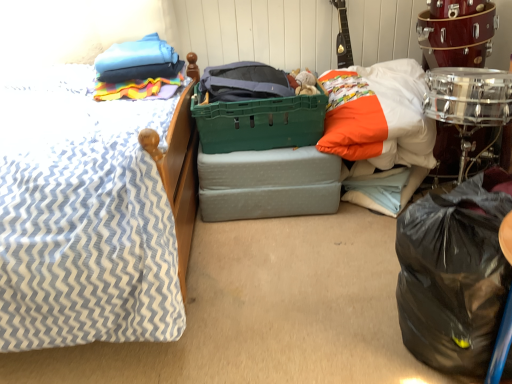
Find the location of a particular element. black plastic bag at lower right is located at coordinates (454, 273).

Describe the element at coordinates (259, 122) in the screenshot. I see `green plastic basket at center` at that location.

Locate an element on the screen. black plastic bag at lower right is located at coordinates (454, 273).

Between black plastic bag at lower right and blue fabric pillow at upper left, the 2th pillow when ordered from right to left, which one appears on the right side from the viewer's perspective?

black plastic bag at lower right is more to the right.

From the image's perspective, who appears lower, black plastic bag at lower right or blue fabric pillow at upper left, which is the first pillow from left to right?

black plastic bag at lower right appears lower in the image.

Is black plastic bag at lower right with blue fabric pillow at upper left, which is the first pillow from left to right?

No, black plastic bag at lower right is not making contact with blue fabric pillow at upper left, which is the first pillow from left to right.

From a real-world perspective, is black plastic bag at lower right above or below blue fabric pillow at upper left, the 2th pillow when ordered from right to left?

black plastic bag at lower right is situated lower than blue fabric pillow at upper left, the 2th pillow when ordered from right to left, in the real world.

From a real-world perspective, who is located lower, shiny silver drum at right or green plastic basket at center?

green plastic basket at center is physically lower.

From their relative heights in the image, would you say shiny silver drum at right is taller or shorter than green plastic basket at center?

Considering their sizes, shiny silver drum at right has more height than green plastic basket at center.

From the image's perspective, which is below, shiny silver drum at right or green plastic basket at center?

green plastic basket at center.

In terms of size, does shiny silver drum at right appear bigger or smaller than green plastic basket at center?

In the image, shiny silver drum at right appears to be smaller than green plastic basket at center.

Which is behind, shiny silver drum at right or black plastic bag at lower right?

shiny silver drum at right is further away from the camera.

From the image's perspective, is shiny silver drum at right above or below black plastic bag at lower right?

Based on their image positions, shiny silver drum at right is located above black plastic bag at lower right.

Based on their sizes in the image, would you say shiny silver drum at right is bigger or smaller than black plastic bag at lower right?

In the image, shiny silver drum at right appears to be larger than black plastic bag at lower right.

Is green plastic storage box at center positioned far away from blue fabric pillow at upper left, the 2th pillow when ordered from right to left?

No, green plastic storage box at center is not far away from blue fabric pillow at upper left, the 2th pillow when ordered from right to left.

From a real-world perspective, who is located lower, green plastic storage box at center or blue fabric pillow at upper left, the 2th pillow when ordered from right to left?

green plastic storage box at center, from a real-world perspective.

Is green plastic storage box at center to the left or to the right of blue fabric pillow at upper left, which is the first pillow from left to right, in the image?

green plastic storage box at center is to the right of blue fabric pillow at upper left, which is the first pillow from left to right.

Is green plastic storage box at center bigger than blue fabric pillow at upper left, the 2th pillow when ordered from right to left?

Yes.

Considering the positions of objects white cotton pillow at upper right, which appears as the second pillow when viewed from the left, and blue fabric pillow at upper left, which is the first pillow from left to right, in the image provided, who is more to the left, white cotton pillow at upper right, which appears as the second pillow when viewed from the left, or blue fabric pillow at upper left, which is the first pillow from left to right,?

Positioned to the left is blue fabric pillow at upper left, which is the first pillow from left to right.

Which of these two, white cotton pillow at upper right, which appears as the second pillow when viewed from the left, or blue fabric pillow at upper left, the 2th pillow when ordered from right to left, is smaller?

With smaller size is blue fabric pillow at upper left, the 2th pillow when ordered from right to left.

Considering the sizes of objects white cotton pillow at upper right, marked as the first pillow in a right-to-left arrangement, and blue fabric pillow at upper left, which is the first pillow from left to right, in the image provided, who is shorter, white cotton pillow at upper right, marked as the first pillow in a right-to-left arrangement, or blue fabric pillow at upper left, which is the first pillow from left to right,?

Standing shorter between the two is blue fabric pillow at upper left, which is the first pillow from left to right.

From the image's perspective, is white cotton pillow at upper right, which appears as the second pillow when viewed from the left, below blue fabric pillow at upper left, which is the first pillow from left to right?

Correct, white cotton pillow at upper right, which appears as the second pillow when viewed from the left, appears lower than blue fabric pillow at upper left, which is the first pillow from left to right, in the image.

Is point (419, 290) positioned before point (270, 104)?

Yes, it is in front of point (270, 104).

Are black plastic bag at lower right and green plastic basket at center making contact?

No, black plastic bag at lower right is not next to green plastic basket at center.

From a real-world perspective, is black plastic bag at lower right above or below green plastic basket at center?

In terms of real-world spatial position, black plastic bag at lower right is below green plastic basket at center.

Between white cotton pillow at upper right, which appears as the second pillow when viewed from the left, and green plastic basket at center, which one has more height?

white cotton pillow at upper right, which appears as the second pillow when viewed from the left, is taller.

Is white cotton pillow at upper right, which appears as the second pillow when viewed from the left, inside the boundaries of green plastic basket at center, or outside?

white cotton pillow at upper right, which appears as the second pillow when viewed from the left, is not inside green plastic basket at center, it's outside.

Considering the sizes of white cotton pillow at upper right, which appears as the second pillow when viewed from the left, and green plastic basket at center in the image, is white cotton pillow at upper right, which appears as the second pillow when viewed from the left, bigger or smaller than green plastic basket at center?

Considering their sizes, white cotton pillow at upper right, which appears as the second pillow when viewed from the left, takes up more space than green plastic basket at center.

Does white cotton pillow at upper right, marked as the first pillow in a right-to-left arrangement, touch green plastic basket at center?

There is a gap between white cotton pillow at upper right, marked as the first pillow in a right-to-left arrangement, and green plastic basket at center.

Where is `the 2nd pillow counting from the left of the black plastic bag at lower right`? The height and width of the screenshot is (384, 512). the 2nd pillow counting from the left of the black plastic bag at lower right is located at coordinates (138, 61).

Where is `drum above the green plastic basket at center (from the image's perspective)`? Image resolution: width=512 pixels, height=384 pixels. drum above the green plastic basket at center (from the image's perspective) is located at coordinates (456, 33).

Looking at the image, which one is located closer to shiny silver drum at right, black plastic bag at lower right or blue fabric pillow at upper left, the 2th pillow when ordered from right to left?

The object closer to shiny silver drum at right is black plastic bag at lower right.

Looking at the image, which one is located closer to blue fabric pillow at upper left, the 2th pillow when ordered from right to left, green plastic basket at center or shiny silver drum at right?

Among the two, green plastic basket at center is located nearer to blue fabric pillow at upper left, the 2th pillow when ordered from right to left.

Estimate the real-world distances between objects in this image. Which object is further from blue fabric pillow at upper left, the 2th pillow when ordered from right to left, white cotton pillow at upper right, which appears as the second pillow when viewed from the left, or green plastic storage box at center?

white cotton pillow at upper right, which appears as the second pillow when viewed from the left.

Based on the photo, based on their spatial positions, is black plastic bag at lower right or green plastic storage box at center further from shiny silver drum at right?

The object further to shiny silver drum at right is black plastic bag at lower right.

Based on their spatial positions, is green plastic storage box at center or shiny silver drum at right further from black plastic bag at lower right?

The object further to black plastic bag at lower right is shiny silver drum at right.

Considering their positions, is black plastic bag at lower right positioned further to green plastic storage box at center than green plastic basket at center?

The object further to green plastic storage box at center is black plastic bag at lower right.

Looking at the image, which one is located closer to green plastic basket at center, white cotton pillow at upper right, which appears as the second pillow when viewed from the left, or shiny silver drum at right?

Among the two, white cotton pillow at upper right, which appears as the second pillow when viewed from the left, is located nearer to green plastic basket at center.

Based on their spatial positions, is green plastic storage box at center or shiny silver drum at right further from blue fabric pillow at upper left, the 2th pillow when ordered from right to left?

shiny silver drum at right.

Locate an element on the screen. The height and width of the screenshot is (384, 512). basket located between blue fabric pillow at upper left, which is the first pillow from left to right, and shiny silver drum at right in the left-right direction is located at coordinates (259, 122).

Image resolution: width=512 pixels, height=384 pixels. What are the coordinates of `storage box between blue fabric pillow at upper left, which is the first pillow from left to right, and white cotton pillow at upper right, marked as the first pillow in a right-to-left arrangement` in the screenshot? It's located at (268, 184).

What are the coordinates of `pillow between black plastic bag at lower right and green plastic basket at center along the z-axis` in the screenshot? It's located at (378, 115).

In order to click on basket between blue fabric pillow at upper left, the 2th pillow when ordered from right to left, and black plastic bag at lower right from left to right in this screenshot , I will do `click(259, 122)`.